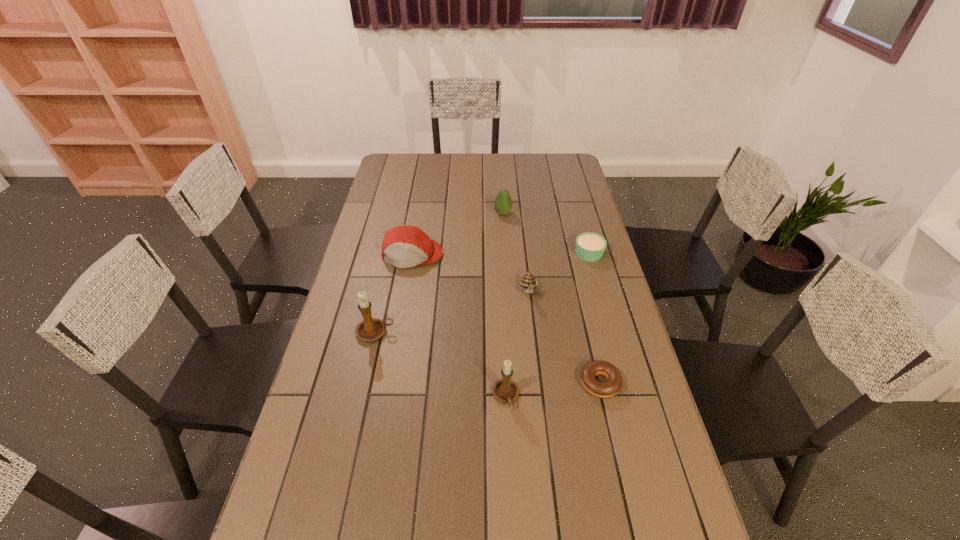
The height and width of the screenshot is (540, 960). What are the coordinates of `vacant point located between the avocado and the doughnut` in the screenshot? It's located at (551, 299).

Where is `free area in between the right candle holder and the doughnut`? Image resolution: width=960 pixels, height=540 pixels. free area in between the right candle holder and the doughnut is located at coordinates (553, 389).

At what (x,y) coordinates should I click in order to perform the action: click on vacant area between the shortest object and the cap. Please return your answer as a coordinate pair (x, y). The height and width of the screenshot is (540, 960). Looking at the image, I should click on (x=506, y=319).

This screenshot has height=540, width=960. Identify the location of free area in between the cap and the doughnut. (506, 319).

You are a GUI agent. You are given a task and a screenshot of the screen. Output one action in this format:
    pyautogui.click(x=<x>, y=<y>)
    Task: Click on the free area in between the farther candle holder and the avocado
    
    Given the screenshot: What is the action you would take?
    pyautogui.click(x=439, y=273)

The image size is (960, 540). What are the coordinates of `unoccupied area between the farthest object and the second shortest object` in the screenshot? It's located at (546, 234).

Find the location of a particular element. The image size is (960, 540). free spot between the shorter candle holder and the third nearest object is located at coordinates (441, 364).

Point out which object is positioned as the fifth nearest to the left candle holder. Please provide its 2D coordinates. Your answer should be formatted as a tuple, i.e. [(x, y)], where the tuple contains the x and y coordinates of a point satisfying the conditions above.

[(503, 203)]

Locate which object ranks fifth in proximity to the farther candle holder. Please provide its 2D coordinates. Your answer should be formatted as a tuple, i.e. [(x, y)], where the tuple contains the x and y coordinates of a point satisfying the conditions above.

[(503, 203)]

This screenshot has width=960, height=540. Identify the location of vacant space that satisfies the following two spatial constraints: 1. on the side of the farther candle holder with the handle; 2. on the back side of the doughnut. (364, 383).